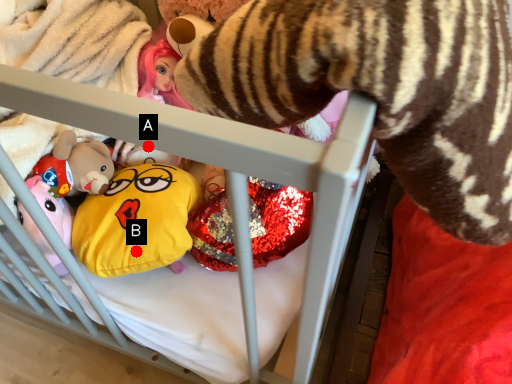
Question: Two points are circled on the image, labeled by A and B beside each circle. Which of the following is the closest to the observer?

Choices:
 (A) A is closer
 (B) B is closer

Answer: (A)